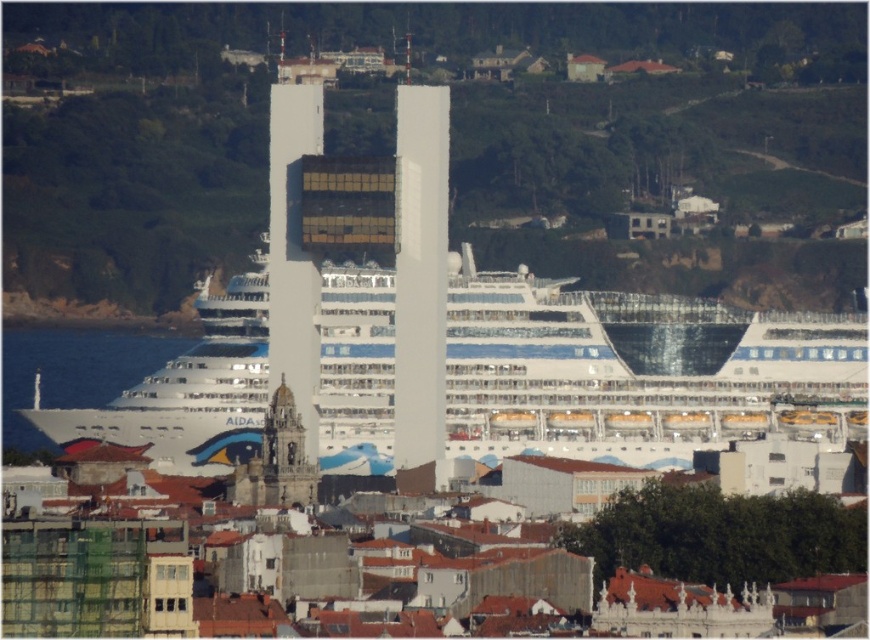
Question: Which point appears closest to the camera in this image?

Choices:
 (A) (278, 99)
 (B) (397, 99)
 (C) (212, 422)
 (D) (7, 410)

Answer: (C)

Question: Which of these objects is positioned farthest from the white glass tower at center?

Choices:
 (A) white glossy cruise ship at center
 (B) white glossy water at lower left

Answer: (B)

Question: Does white glossy cruise ship at center appear on the right side of white glass tower at center?

Choices:
 (A) yes
 (B) no

Answer: (A)

Question: Does white glass tower at center have a greater width compared to white glossy water at lower left?

Choices:
 (A) yes
 (B) no

Answer: (B)

Question: Is white glossy cruise ship at center to the left of white glossy building at center from the viewer's perspective?

Choices:
 (A) no
 (B) yes

Answer: (A)

Question: Which of these objects is positioned farthest from the white glossy building at center?

Choices:
 (A) white glossy water at lower left
 (B) white glossy cruise ship at center
 (C) white glass tower at center

Answer: (A)